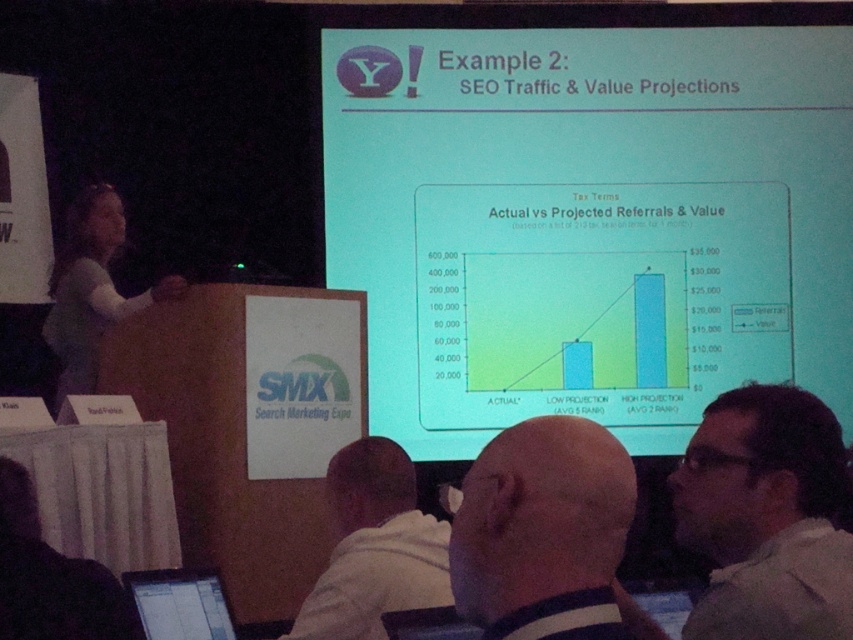
Is bald head at center above black glossy tablet at lower left?

Correct, bald head at center is located above black glossy tablet at lower left.

Does point (560, 531) come farther from viewer compared to point (195, 612)?

No, it is not.

Image resolution: width=853 pixels, height=640 pixels. What do you see at coordinates (546, 532) in the screenshot?
I see `bald head at center` at bounding box center [546, 532].

Where is `bald head at center`? bald head at center is located at coordinates (546, 532).

Is green matte projector screen at upper center thinner than bald head at center?

No, green matte projector screen at upper center is not thinner than bald head at center.

Who is positioned more to the right, green matte projector screen at upper center or bald head at center?

From the viewer's perspective, green matte projector screen at upper center appears more on the right side.

Locate an element on the screen. The width and height of the screenshot is (853, 640). green matte projector screen at upper center is located at coordinates (589, 221).

Who is shorter, green matte projector screen at upper center or dark brown hair at upper right?

dark brown hair at upper right is shorter.

Where is `green matte projector screen at upper center`? The image size is (853, 640). green matte projector screen at upper center is located at coordinates (589, 221).

Image resolution: width=853 pixels, height=640 pixels. I want to click on green matte projector screen at upper center, so click(x=589, y=221).